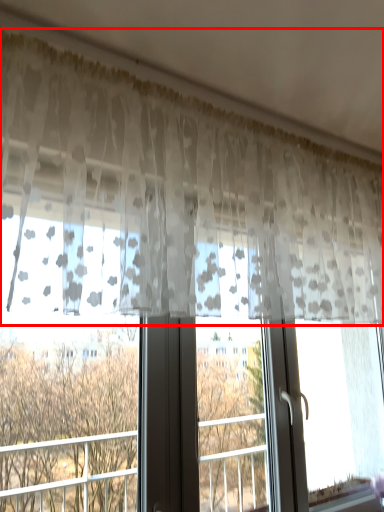
Question: From the image's perspective, considering the relative positions of curtain (annotated by the red box) and tree in the image provided, where is curtain (annotated by the red box) located with respect to the staircase?

Choices:
 (A) below
 (B) above

Answer: (B)